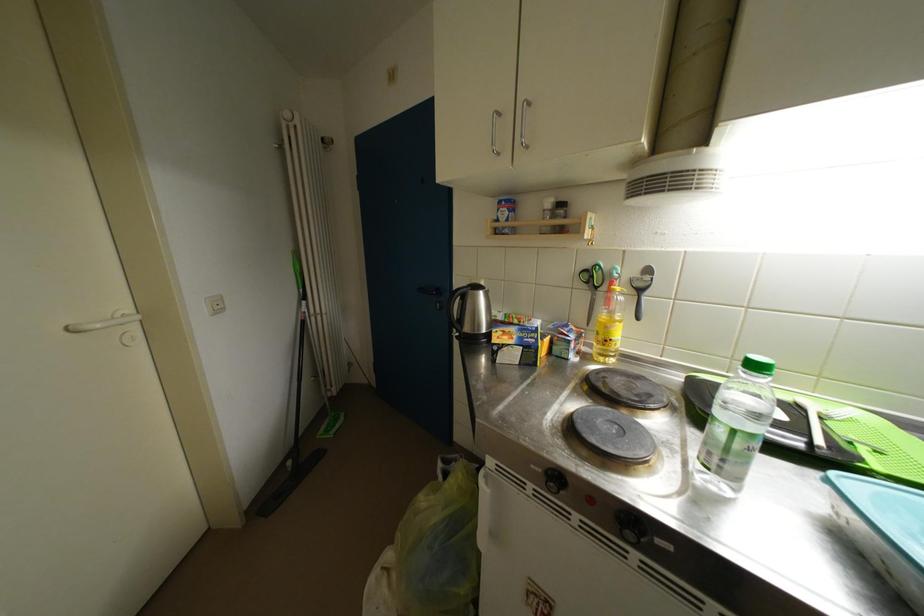
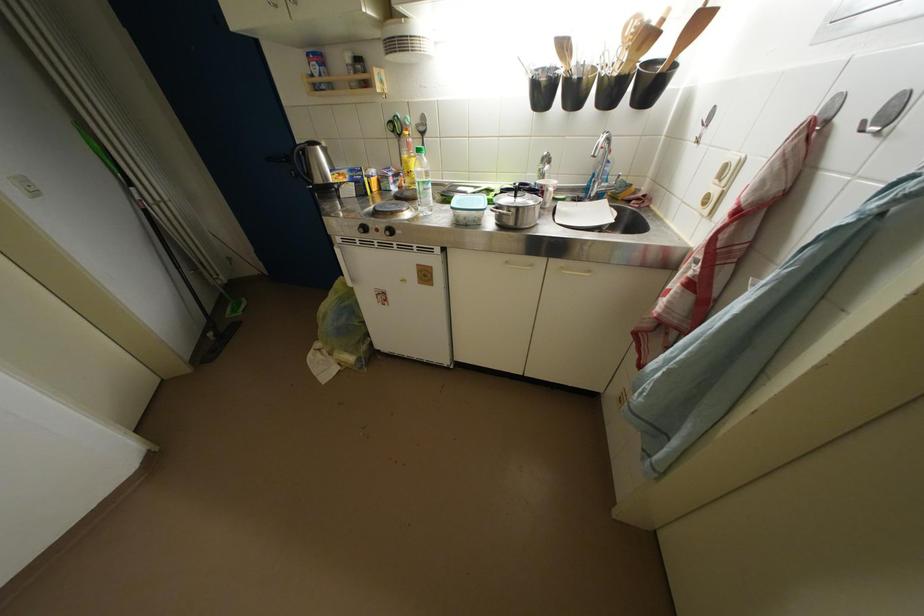
Locate, in the second image, the point that corresponds to (602,292) in the first image.

(407, 140)